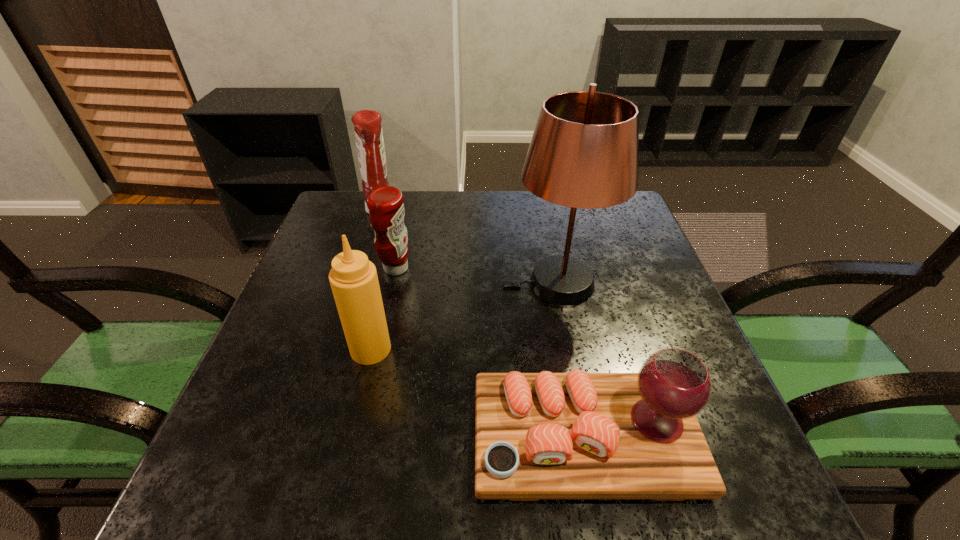
Find the location of a particular element. object that can be found as the second closest to the shortest condiment is located at coordinates (353, 278).

In order to click on the fourth closest object relative to the farthest object in this screenshot , I will do `click(576, 435)`.

Image resolution: width=960 pixels, height=540 pixels. Identify the location of condiment that is the second closest to the tallest object. (353, 278).

Locate an element on the screen. This screenshot has width=960, height=540. the second closest condiment relative to the farthest object is located at coordinates (353, 278).